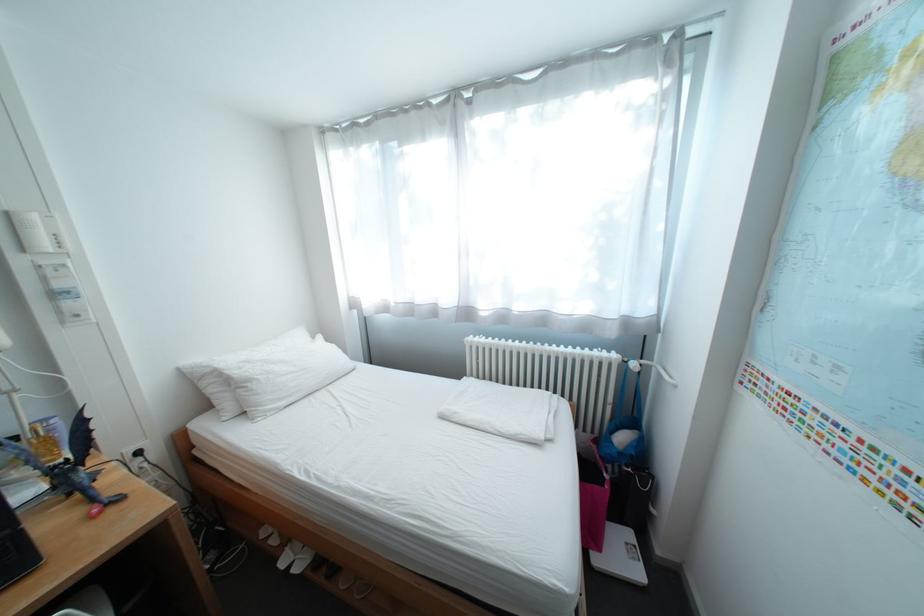
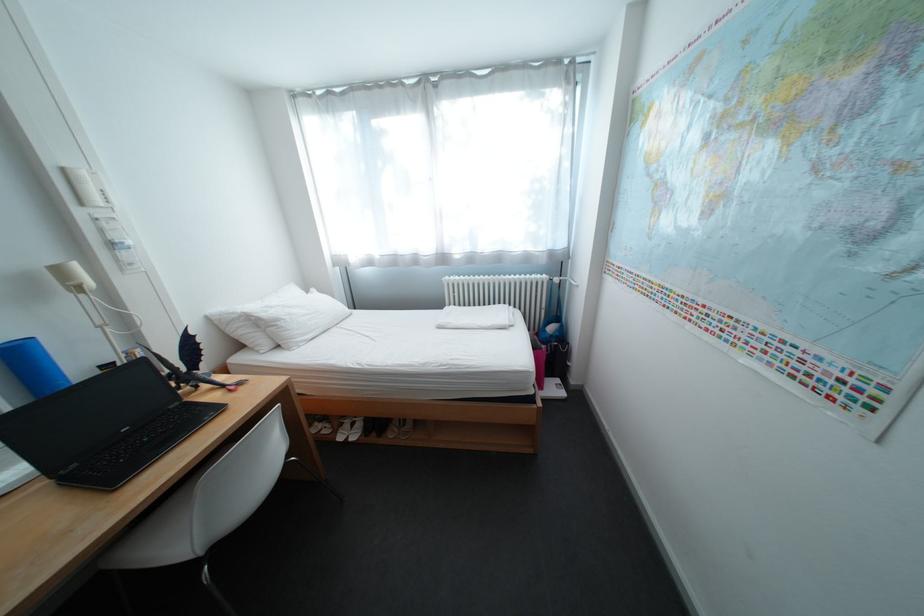
In the second image, find the point that corresponds to point (263, 383) in the first image.

(292, 322)